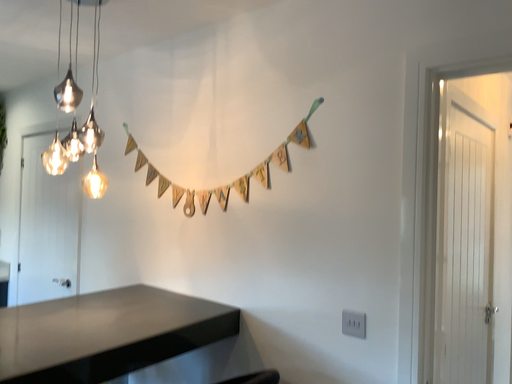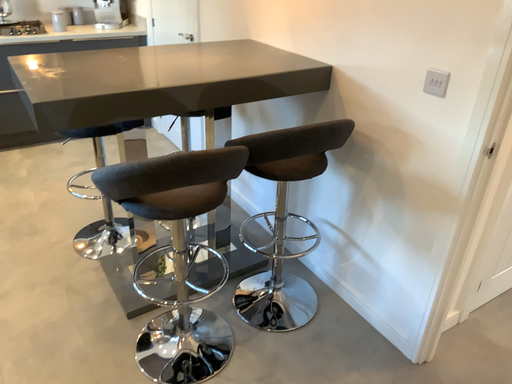
Question: Which way did the camera rotate in the video?

Choices:
 (A) rotated left
 (B) rotated right

Answer: (A)